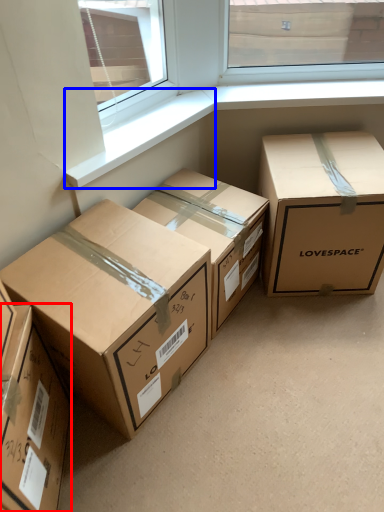
Question: Which object appears closest to the camera in this image, box (highlighted by a red box) or window sill (highlighted by a blue box)?

Choices:
 (A) box
 (B) window sill

Answer: (A)